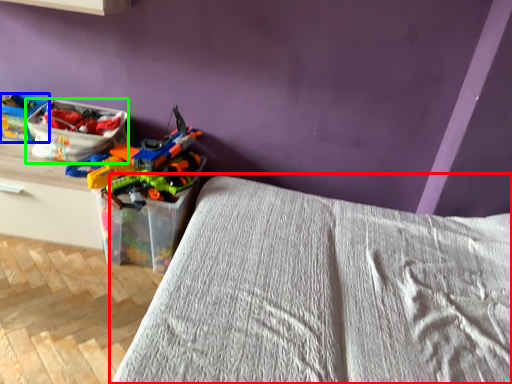
Question: Which is farther away from bed (highlighted by a red box)? kit (highlighted by a blue box) or kit (highlighted by a green box)?

Choices:
 (A) kit
 (B) kit

Answer: (A)